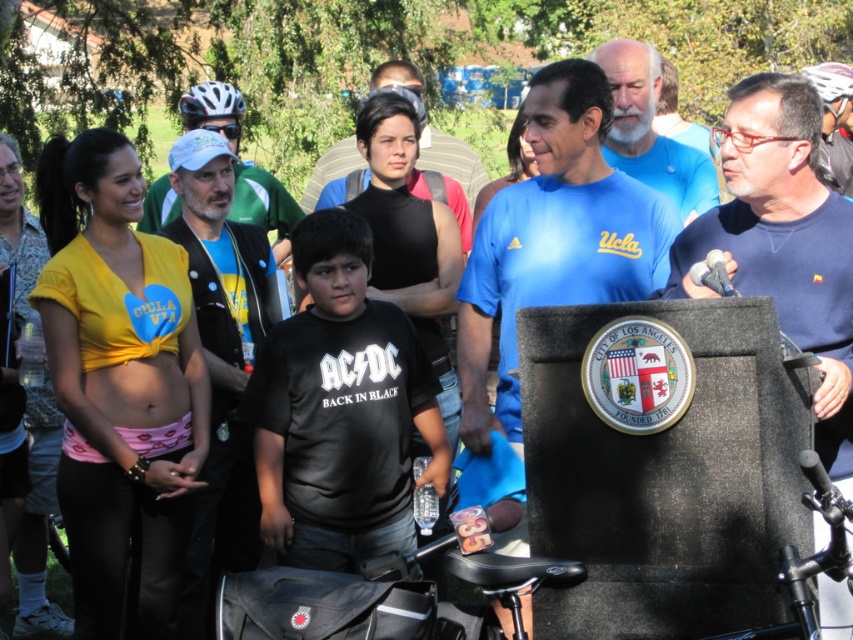
What do you see at coordinates (554, 240) in the screenshot? I see `blue fabric shirt at center` at bounding box center [554, 240].

Is blue fabric shirt at center closer to camera compared to pink fabric belly at center?

No, blue fabric shirt at center is further to the viewer.

Find the location of a particular element. This screenshot has width=853, height=640. blue fabric shirt at center is located at coordinates (554, 240).

Between matte black helmet at upper left and shiny silver helmet at upper right, which one appears on the left side from the viewer's perspective?

Positioned to the left is matte black helmet at upper left.

Can you confirm if matte black helmet at upper left is taller than shiny silver helmet at upper right?

Correct, matte black helmet at upper left is much taller as shiny silver helmet at upper right.

Locate an element on the screen. This screenshot has width=853, height=640. matte black helmet at upper left is located at coordinates (264, 204).

Where is `matte black helmet at upper left`? The image size is (853, 640). matte black helmet at upper left is located at coordinates (264, 204).

Consider the image. Measure the distance between matte black helmet at upper left and white matte bicycle helmet at upper left.

The distance of matte black helmet at upper left from white matte bicycle helmet at upper left is 20.62 inches.

Is point (234, 99) less distant than point (213, 90)?

No, it is behind (213, 90).

In order to click on matte black helmet at upper left in this screenshot , I will do `click(264, 204)`.

Where is `matte black helmet at upper left`? Image resolution: width=853 pixels, height=640 pixels. matte black helmet at upper left is located at coordinates tap(264, 204).